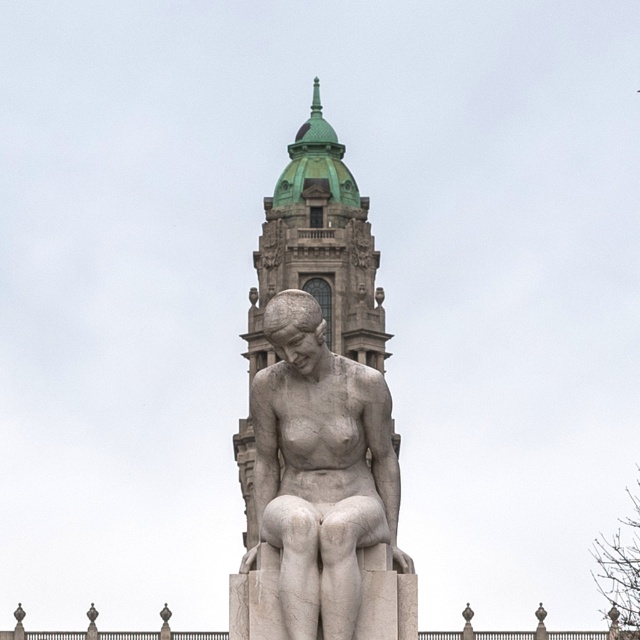
You are standing at the entrance of the building with the green dome and want to find the white marble statue at center. According to the coordinates provided, in which direction should you move relative to your current position?

The white marble statue at center is located at coordinates point (321, 472). Since the x and y coordinates are both above 0.5, you should move towards the northeast direction from your current position to reach it.